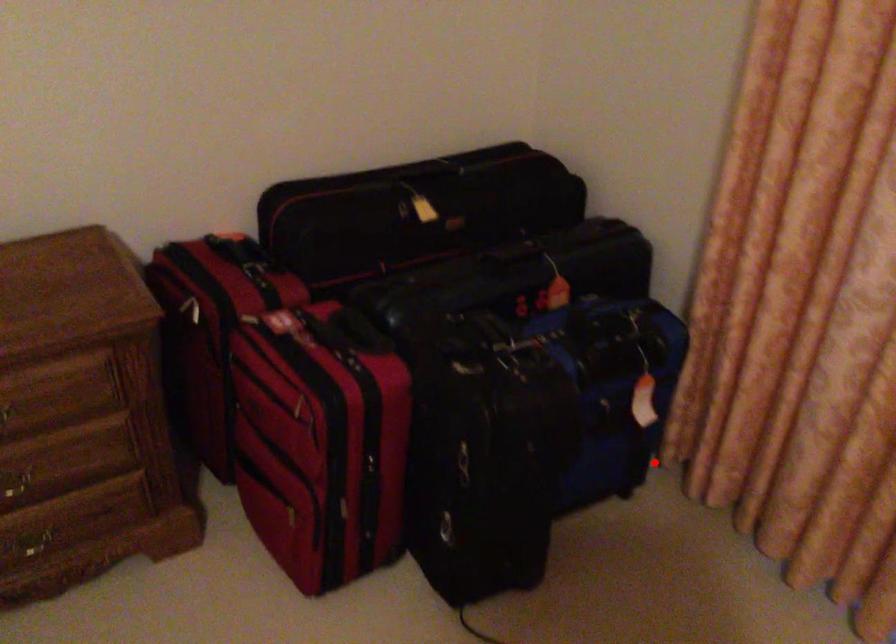
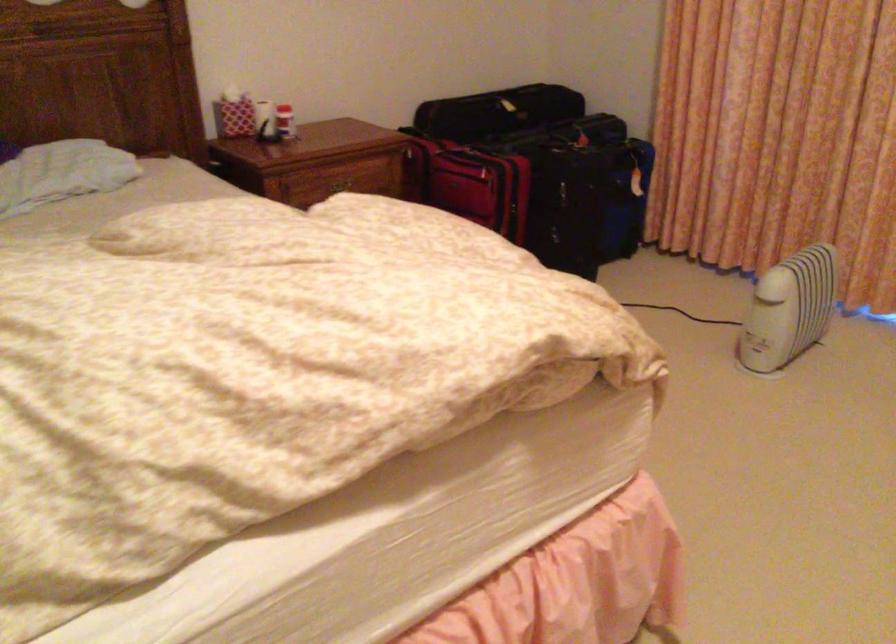
Find the pixel in the second image that matches the highlighted location in the first image.

(649, 223)